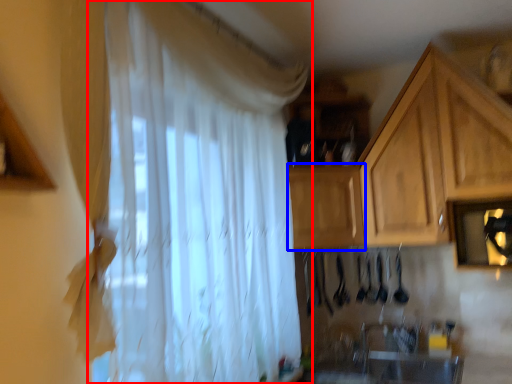
Question: Which point is further to the camera, curtain (highlighted by a red box) or cabinetry (highlighted by a blue box)?

Choices:
 (A) curtain
 (B) cabinetry

Answer: (B)